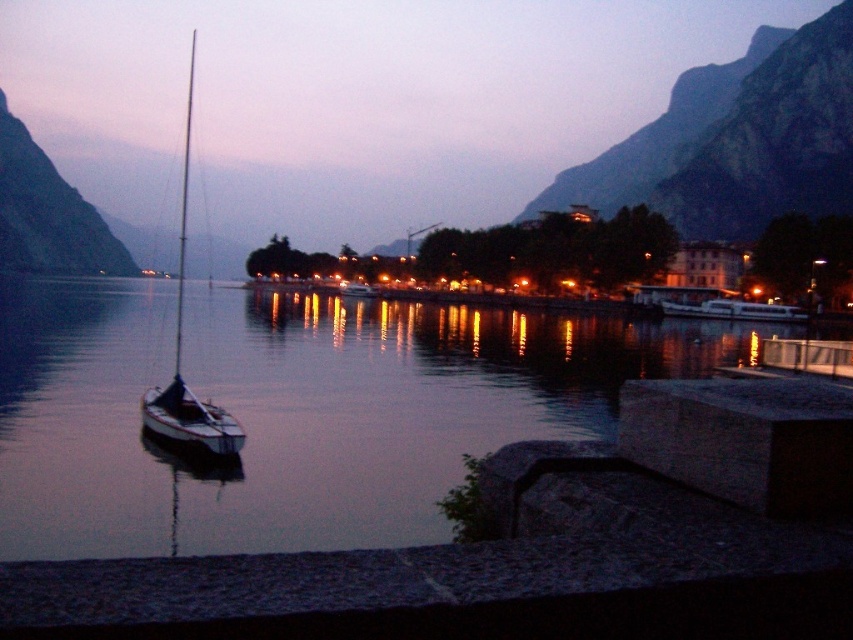
Question: In this image, where is smooth water at center located relative to white matte sailboat at left?

Choices:
 (A) right
 (B) left

Answer: (A)

Question: Which object is farther from the camera taking this photo?

Choices:
 (A) white matte sailboat at left
 (B) green rock mountain at left
 (C) smooth water at center
 (D) rugged stone mountain at upper right

Answer: (B)

Question: Observing the image, what is the correct spatial positioning of rugged stone mountain at upper right in reference to white matte sailboat at left?

Choices:
 (A) below
 (B) above

Answer: (B)

Question: Is smooth water at center in front of rugged stone mountain at upper right?

Choices:
 (A) no
 (B) yes

Answer: (B)

Question: Estimate the real-world distances between objects in this image. Which object is closer to the white matte sailboat at left?

Choices:
 (A) rugged stone mountain at upper right
 (B) smooth water at center

Answer: (B)

Question: Which object appears closest to the camera in this image?

Choices:
 (A) green rock mountain at left
 (B) white matte sailboat at left

Answer: (B)